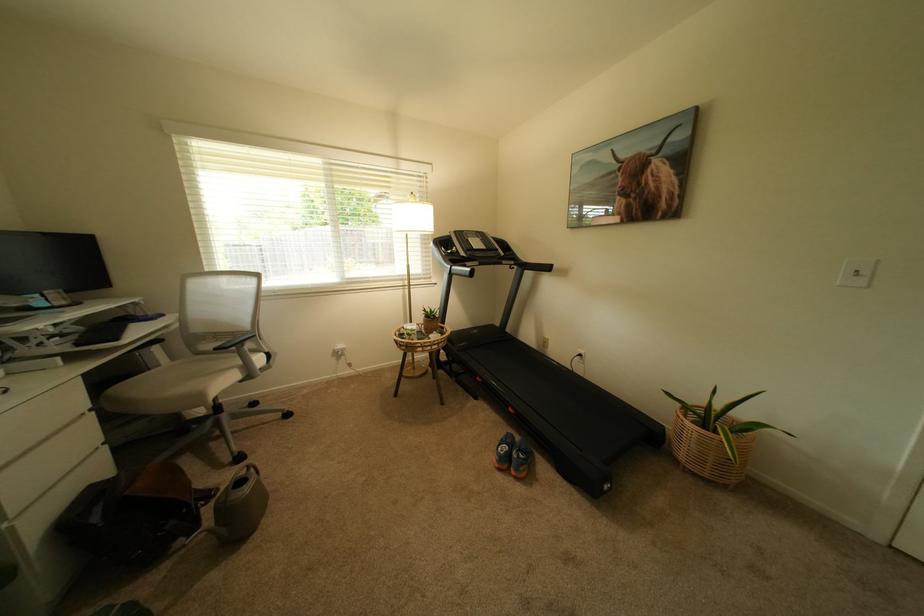
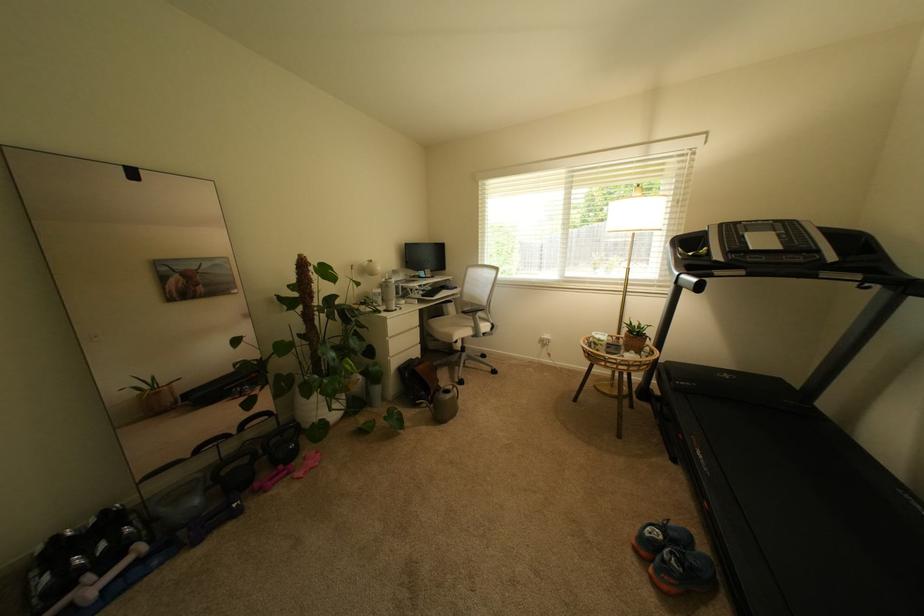
Locate, in the second image, the point that corresponds to point 517,448 in the first image.

(673, 540)